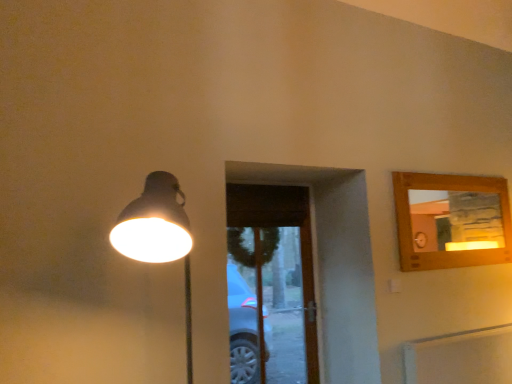
Question: Is matte black lamp at left shorter than transparent glass door at center?

Choices:
 (A) no
 (B) yes

Answer: (B)

Question: Is matte black lamp at left touching transparent glass door at center?

Choices:
 (A) no
 (B) yes

Answer: (A)

Question: Is matte black lamp at left further to camera compared to transparent glass door at center?

Choices:
 (A) no
 (B) yes

Answer: (A)

Question: Could you tell me if matte black lamp at left is facing transparent glass door at center?

Choices:
 (A) no
 (B) yes

Answer: (A)

Question: Does matte black lamp at left lie in front of transparent glass door at center?

Choices:
 (A) no
 (B) yes

Answer: (B)

Question: From a real-world perspective, is matte black lamp at left positioned under transparent glass door at center based on gravity?

Choices:
 (A) yes
 (B) no

Answer: (B)

Question: Is transparent glass door at center located outside matte black lamp at left?

Choices:
 (A) no
 (B) yes

Answer: (B)

Question: From the image's perspective, does transparent glass door at center appear lower than matte black lamp at left?

Choices:
 (A) yes
 (B) no

Answer: (A)

Question: From the image's perspective, does transparent glass door at center appear higher than matte black lamp at left?

Choices:
 (A) no
 (B) yes

Answer: (A)

Question: Considering the relative sizes of transparent glass door at center and matte black lamp at left in the image provided, is transparent glass door at center shorter than matte black lamp at left?

Choices:
 (A) no
 (B) yes

Answer: (A)

Question: Is transparent glass door at center taller than matte black lamp at left?

Choices:
 (A) no
 (B) yes

Answer: (B)

Question: From a real-world perspective, is transparent glass door at center physically below matte black lamp at left?

Choices:
 (A) yes
 (B) no

Answer: (A)

Question: Is matte black lamp at left wider or thinner than transparent glass door at center?

Choices:
 (A) wide
 (B) thin

Answer: (A)